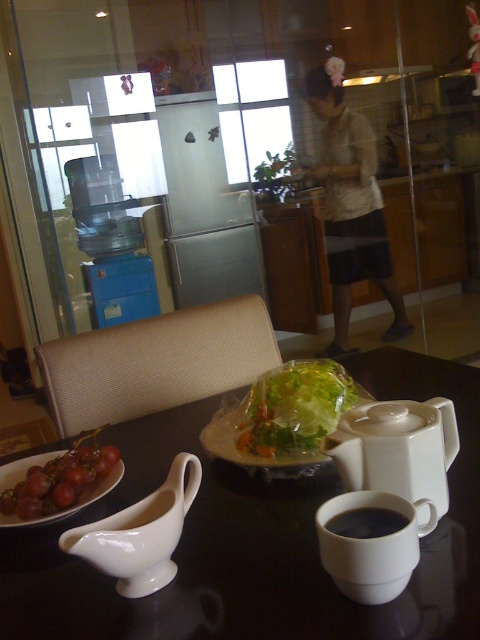
What object is located at the coordinates point (255, 540) in the image?

The point (255, 540) marks the white glossy table at center.

You are standing in the kitchen and see the point marked at coordinates (350,204). What object is located at that point?

The point at coordinates (350,204) corresponds to the white cotton shirt at center.